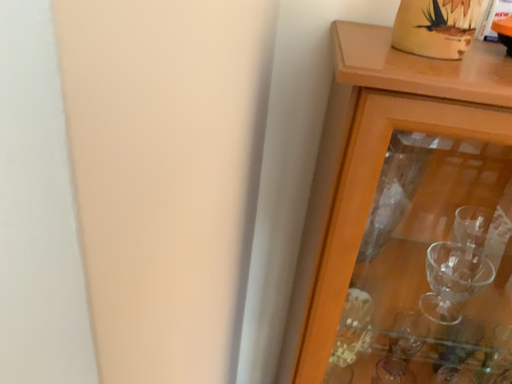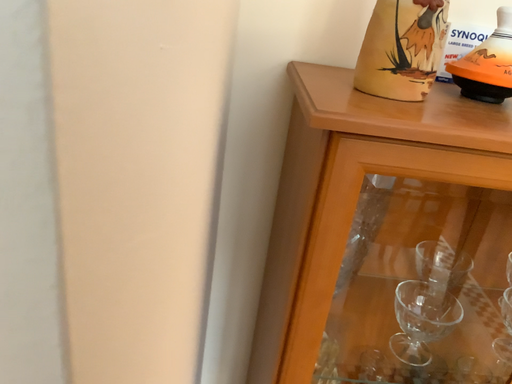
Question: Which way did the camera rotate in the video?

Choices:
 (A) rotated left
 (B) rotated right

Answer: (B)